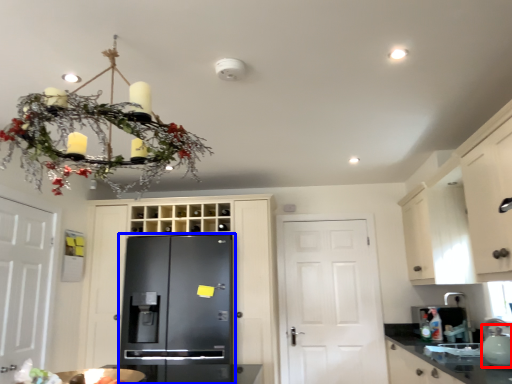
Question: Among these objects, which one is nearest to the camera, tea pot (highlighted by a red box) or refrigerator (highlighted by a blue box)?

Choices:
 (A) tea pot
 (B) refrigerator

Answer: (A)